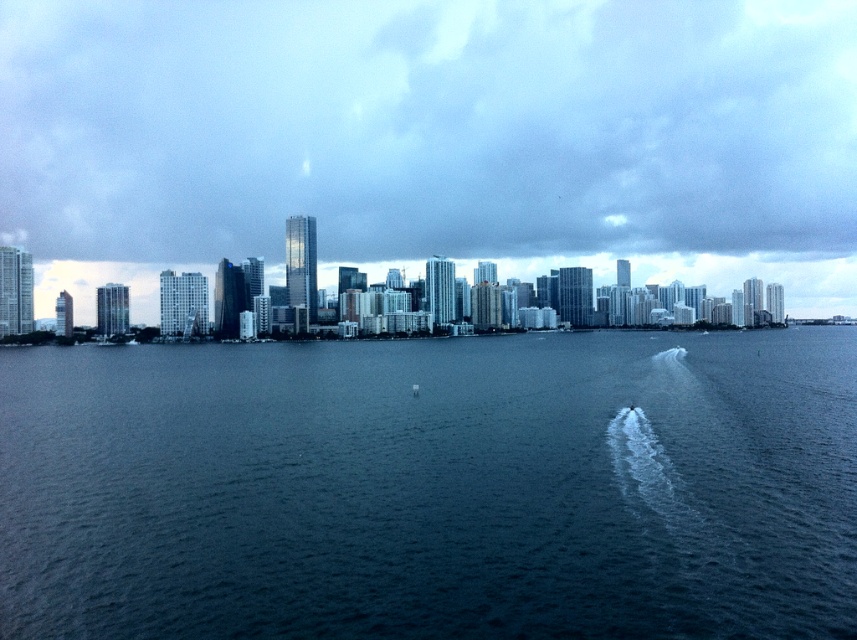
Which of these two, dark blue water at center or cloudy sky at upper center, stands taller?

With more height is cloudy sky at upper center.

Does dark blue water at center lie behind cloudy sky at upper center?

No, dark blue water at center is in front of cloudy sky at upper center.

Who is more forward, (836, 634) or (433, 17)?

Point (836, 634)

Locate an element on the screen. The image size is (857, 640). dark blue water at center is located at coordinates (433, 486).